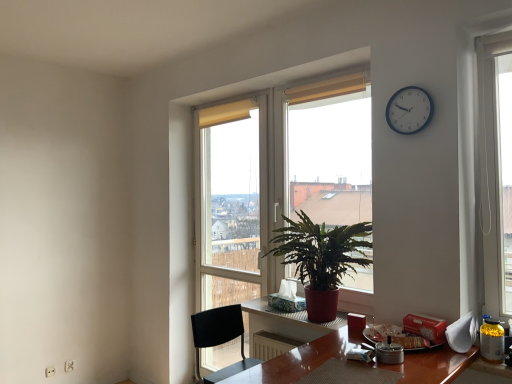
Question: Is black plastic chair at lower center completely or partially inside green leafy plant at center?

Choices:
 (A) yes
 (B) no

Answer: (B)

Question: Is green leafy plant at center facing away from black plastic chair at lower center?

Choices:
 (A) yes
 (B) no

Answer: (B)

Question: From a real-world perspective, is green leafy plant at center physically above black plastic chair at lower center?

Choices:
 (A) yes
 (B) no

Answer: (A)

Question: Is green leafy plant at center thinner than black plastic chair at lower center?

Choices:
 (A) no
 (B) yes

Answer: (B)

Question: Is green leafy plant at center positioned in front of black plastic chair at lower center?

Choices:
 (A) no
 (B) yes

Answer: (A)

Question: In terms of height, does green leafy plant at center look taller or shorter compared to black plastic chair at lower center?

Choices:
 (A) tall
 (B) short

Answer: (A)

Question: From the image's perspective, is green leafy plant at center above or below black plastic chair at lower center?

Choices:
 (A) below
 (B) above

Answer: (B)

Question: Is point (338, 97) positioned closer to the camera than point (218, 309)?

Choices:
 (A) closer
 (B) farther

Answer: (B)

Question: Considering the relative positions of green leafy plant at center and black plastic chair at lower center in the image provided, is green leafy plant at center to the left or to the right of black plastic chair at lower center?

Choices:
 (A) left
 (B) right

Answer: (B)

Question: Does point (302, 269) appear closer or farther from the camera than point (413, 97)?

Choices:
 (A) closer
 (B) farther

Answer: (B)

Question: Looking at their shapes, would you say green glossy plant at center is wider or thinner than white plastic clock at upper right?

Choices:
 (A) wide
 (B) thin

Answer: (A)

Question: From the image's perspective, is green glossy plant at center above or below white plastic clock at upper right?

Choices:
 (A) above
 (B) below

Answer: (B)

Question: Is green glossy plant at center in front of or behind white plastic clock at upper right in the image?

Choices:
 (A) behind
 (B) front

Answer: (A)

Question: Does point [x=288, y=192] appear closer or farther from the camera than point [x=401, y=114]?

Choices:
 (A) farther
 (B) closer

Answer: (A)

Question: Choose the correct answer: Is green leafy plant at center inside white plastic clock at upper right or outside it?

Choices:
 (A) inside
 (B) outside

Answer: (B)